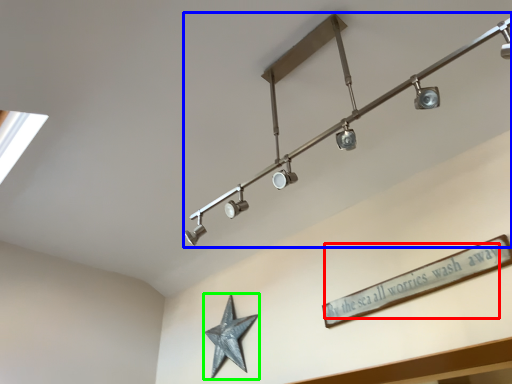
Question: Considering the real-world distances, which object is closest to writing (highlighted by a red box)? lamp (highlighted by a blue box) or star (highlighted by a green box).

Choices:
 (A) lamp
 (B) star

Answer: (A)